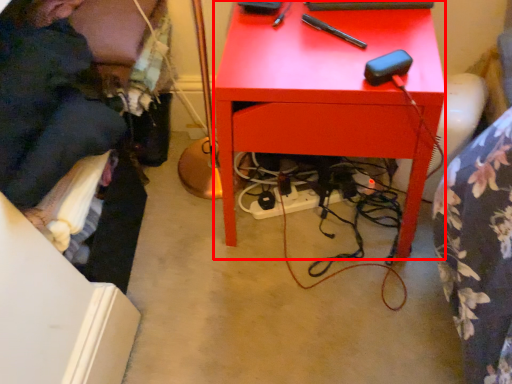
Question: Observing the image, what is the correct spatial positioning of desk (annotated by the red box) in reference to person?

Choices:
 (A) right
 (B) left

Answer: (A)